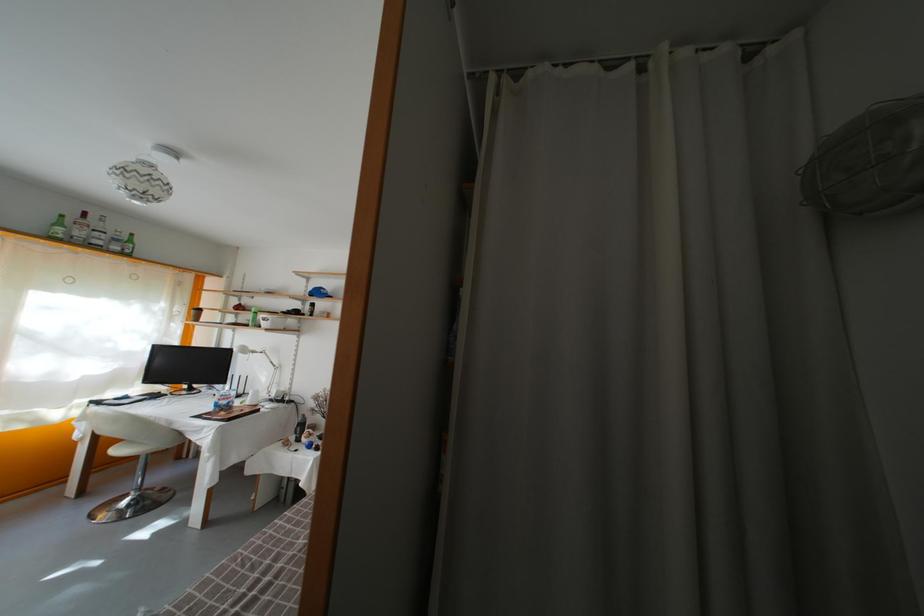
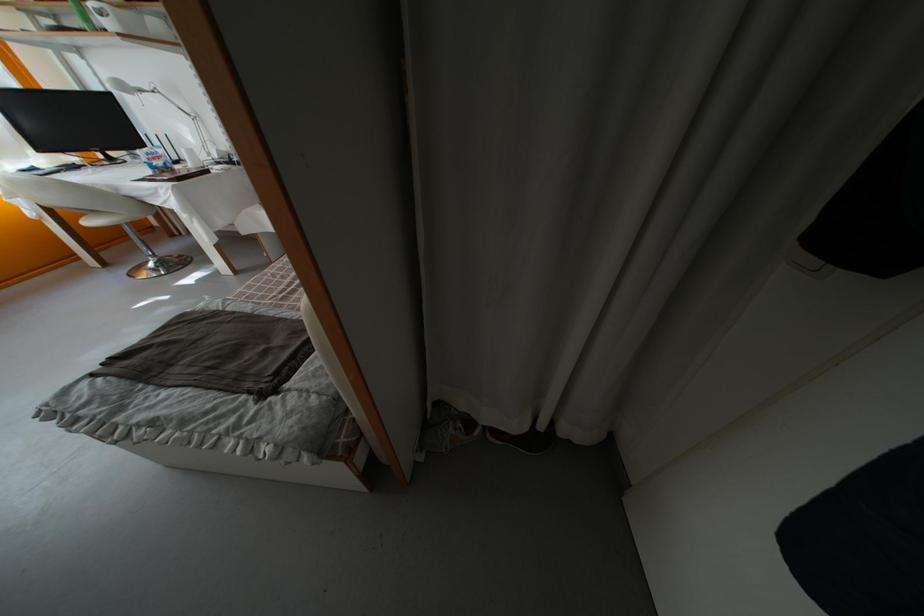
In the second image, find the point that corresponds to (247,398) in the first image.

(180, 164)